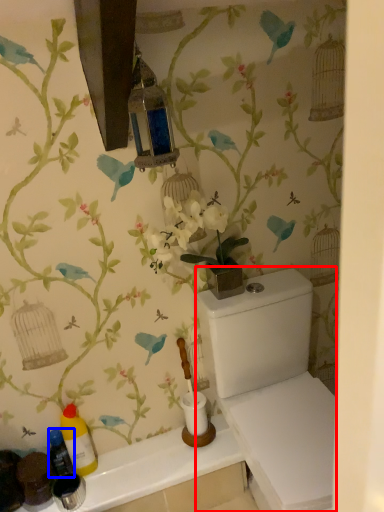
Question: Which point is further to the camera, porcelain (highlighted by a red box) or bottle (highlighted by a blue box)?

Choices:
 (A) porcelain
 (B) bottle

Answer: (B)